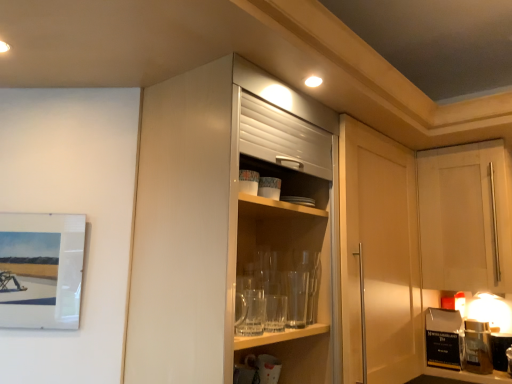
Question: From a real-world perspective, is glossy white cabinet at center, which ranks as the first cabinetry in front-to-back order, positioned above or below matte white picture frame at left?

Choices:
 (A) above
 (B) below

Answer: (A)

Question: Considering their positions, is glossy white cabinet at center, acting as the second cabinetry starting from the right, located in front of or behind matte white picture frame at left?

Choices:
 (A) front
 (B) behind

Answer: (A)

Question: Which of these objects is positioned closest to the white matte cabinet at upper right, acting as the 2th cabinetry starting from the front?

Choices:
 (A) matte white picture frame at left
 (B) glossy white cabinet at center, acting as the second cabinetry starting from the right

Answer: (B)

Question: Considering the real-world distances, which object is closest to the white matte cabinet at upper right, acting as the 2th cabinetry starting from the front?

Choices:
 (A) glossy white cabinet at center, which ranks as the first cabinetry in front-to-back order
 (B) matte white picture frame at left

Answer: (A)